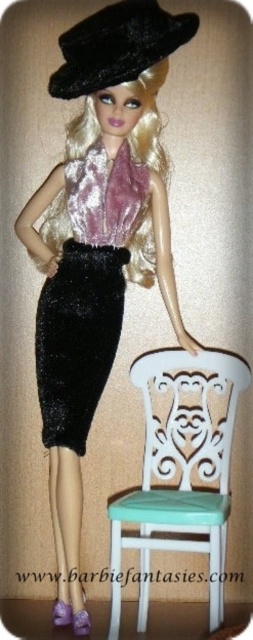
Who is shorter, velvet black skirt at center or black velvet hat at upper center?

Standing shorter between the two is black velvet hat at upper center.

Who is higher up, velvet black skirt at center or black velvet hat at upper center?

black velvet hat at upper center is higher up.

Is point (93, 227) in front of point (171, 51)?

That is False.

At what (x,y) coordinates should I click in order to perform the action: click on velvet black skirt at center. Please return your answer as a coordinate pair (x, y). The height and width of the screenshot is (640, 253). Looking at the image, I should click on (86, 296).

Between point (183, 476) and point (138, 168), which one is positioned in front?

Point (138, 168) is in front.

Based on the photo, is white painted wood chair at lower center wider than velvet black skirt at center?

Yes.

Between point (219, 481) and point (59, 428), which one is positioned in front?

Point (59, 428) is more forward.

You are a GUI agent. You are given a task and a screenshot of the screen. Output one action in this format:
    pyautogui.click(x=<x>, y=<y>)
    Task: Click on the white painted wood chair at lower center
    This screenshot has height=640, width=253.
    Given the screenshot: What is the action you would take?
    pyautogui.click(x=180, y=470)

Is the position of white painted wood chair at lower center less distant than that of black velvet hat at upper center?

Yes.

How distant is white painted wood chair at lower center from black velvet hat at upper center?

white painted wood chair at lower center is 22.20 inches from black velvet hat at upper center.

Is point (148, 420) positioned before point (103, 40)?

No, (148, 420) is further to viewer.

The height and width of the screenshot is (640, 253). I want to click on white painted wood chair at lower center, so click(x=180, y=470).